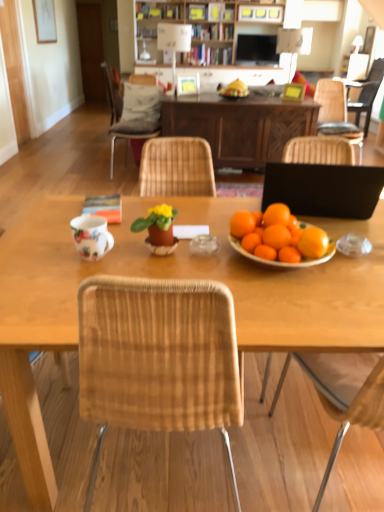
Where is `free space between matte clay pot at center and floral ceramic mug at center`? free space between matte clay pot at center and floral ceramic mug at center is located at coordinates (134, 253).